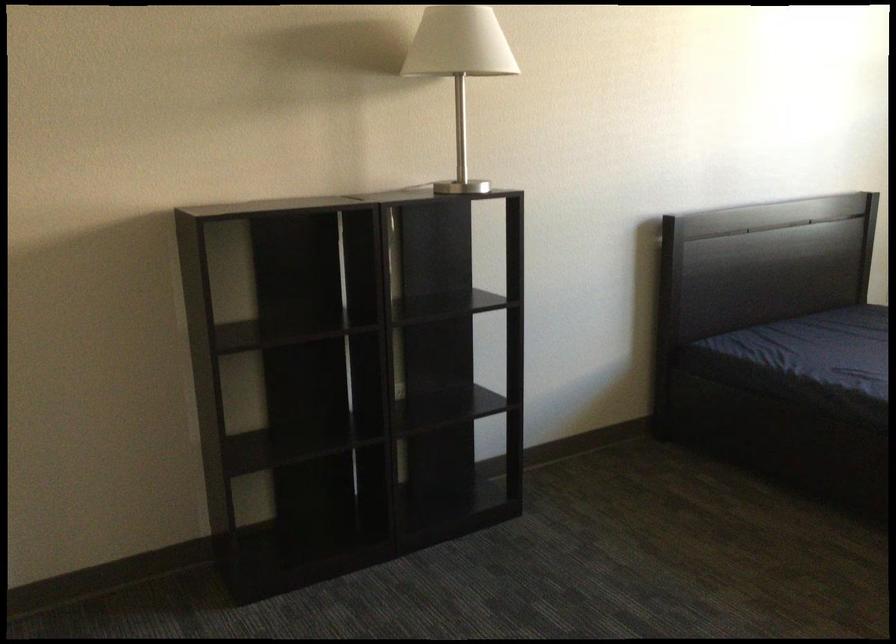
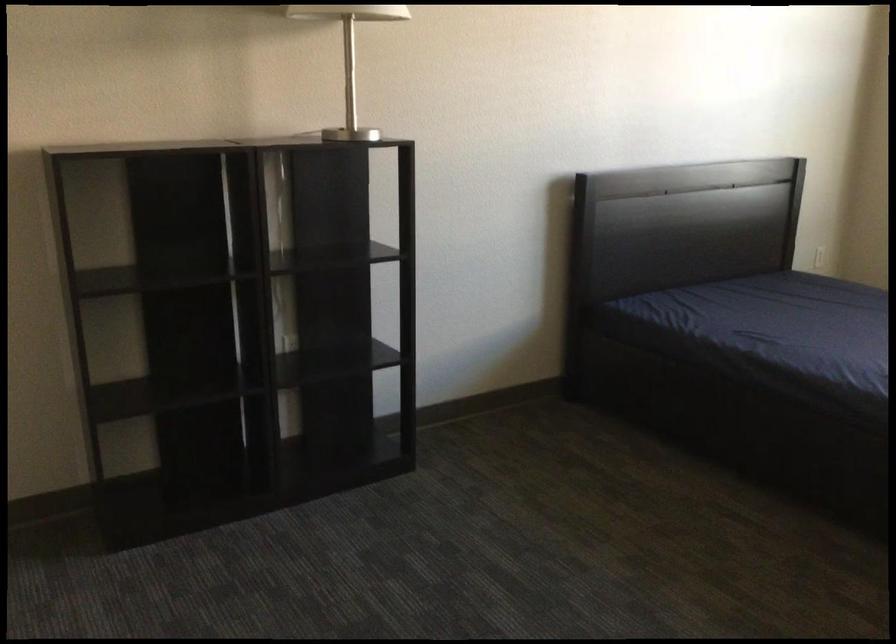
Question: In a continuous first-person perspective shot, in which direction is the camera moving?

Choices:
 (A) Left
 (B) Right
 (C) Forward
 (D) Backward

Answer: (B)